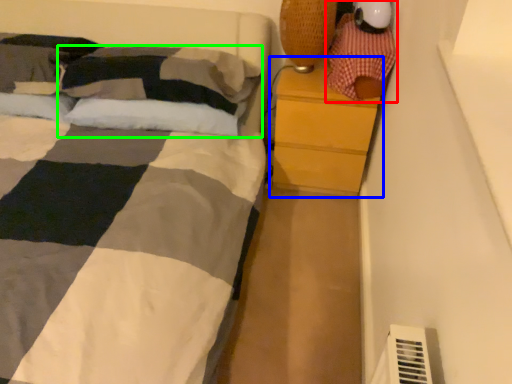
Question: Based on their relative distances, which object is farther from toy (highlighted by a red box)? Choose from chest of drawers (highlighted by a blue box) and pillow (highlighted by a green box).

Choices:
 (A) chest of drawers
 (B) pillow

Answer: (B)